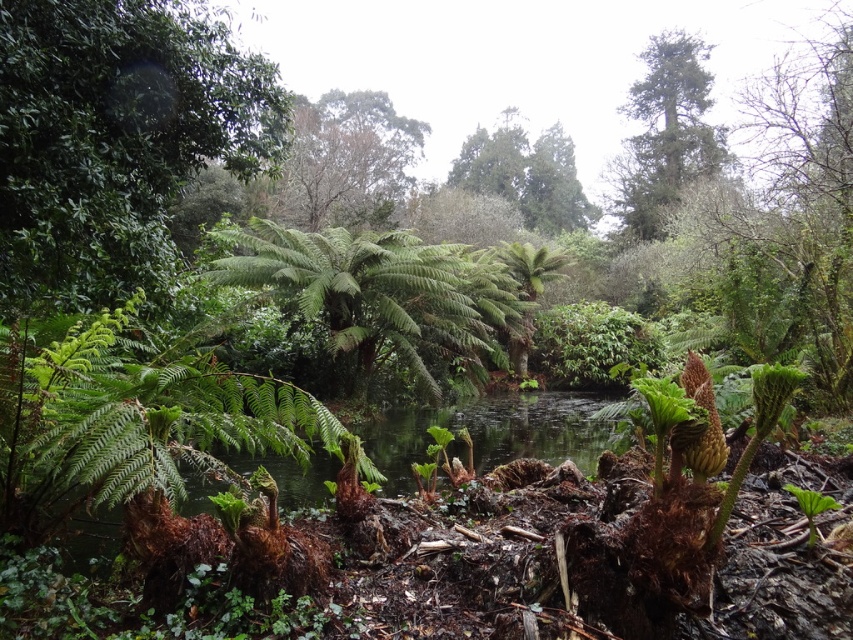
Question: Does green leafy fern at center appear over green leafy tree at upper center?

Choices:
 (A) no
 (B) yes

Answer: (A)

Question: Estimate the real-world distances between objects in this image. Which object is farther from the green leafy tree at upper center?

Choices:
 (A) green leafy fern at center
 (B) green glossy leafy tree at upper left

Answer: (A)

Question: Is green glossy leafy tree at upper left above green leafy fern at center?

Choices:
 (A) no
 (B) yes

Answer: (B)

Question: Is green glossy leafy tree at upper left smaller than green textured tree at upper right?

Choices:
 (A) yes
 (B) no

Answer: (A)

Question: Which point is farther from the camera taking this photo?

Choices:
 (A) (618, 179)
 (B) (0, 256)
 (C) (273, 444)
 (D) (529, 168)

Answer: (D)

Question: Estimate the real-world distances between objects in this image. Which object is farther from the green leafy fern at center?

Choices:
 (A) green leafy tree at upper center
 (B) green textured tree at upper right
 (C) green glossy leafy tree at upper left

Answer: (A)